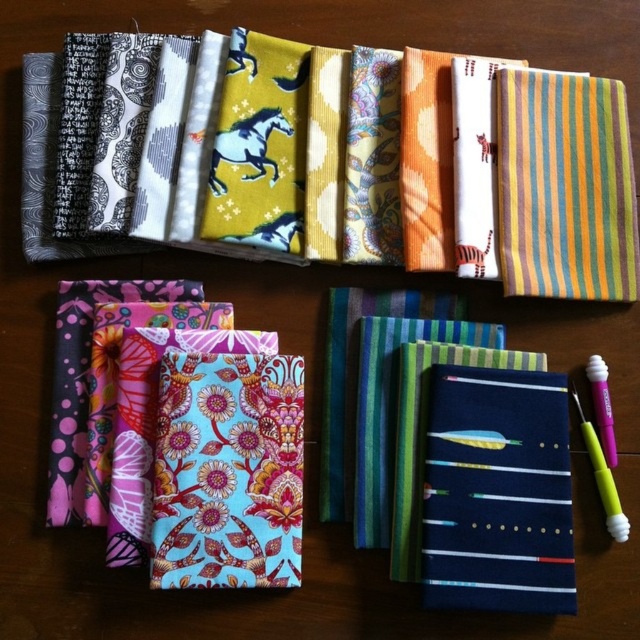
Question: Is navy blue fabric at center bigger than translucent purple pen at lower right?

Choices:
 (A) no
 (B) yes

Answer: (B)

Question: Which object is closer to the camera taking this photo?

Choices:
 (A) translucent purple pen at lower right
 (B) navy blue fabric at center

Answer: (B)

Question: Does navy blue fabric at center appear under translucent purple pen at lower right?

Choices:
 (A) no
 (B) yes

Answer: (B)

Question: Can you confirm if navy blue fabric at center is positioned to the left of translucent purple pen at lower right?

Choices:
 (A) yes
 (B) no

Answer: (A)

Question: Among these points, which one is farthest from the camera?

Choices:
 (A) (588, 365)
 (B) (547, 545)

Answer: (A)

Question: Which object is farther from the camera taking this photo?

Choices:
 (A) translucent purple pen at lower right
 (B) navy blue fabric at center

Answer: (A)